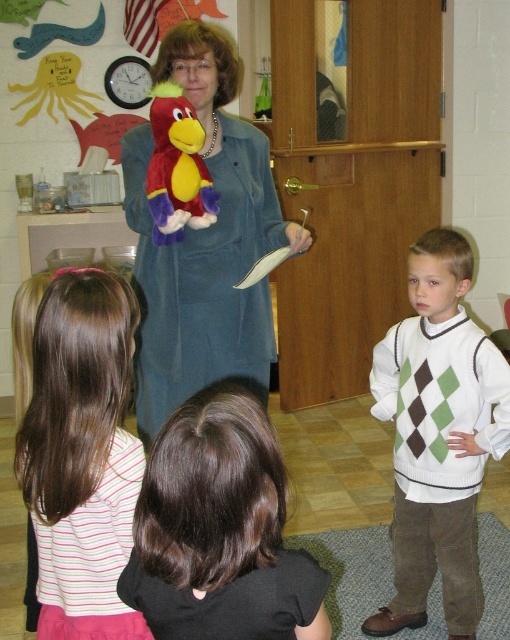
Which is more to the right, velvety blue coat at center or green argyle sweater at right?

green argyle sweater at right is more to the right.

Between point (201, 109) and point (436, 467), which one is positioned in front?

Point (201, 109) is more forward.

This screenshot has height=640, width=510. What do you see at coordinates (204, 243) in the screenshot?
I see `velvety blue coat at center` at bounding box center [204, 243].

The height and width of the screenshot is (640, 510). I want to click on velvety blue coat at center, so click(204, 243).

This screenshot has height=640, width=510. What do you see at coordinates (204, 243) in the screenshot?
I see `velvety blue coat at center` at bounding box center [204, 243].

Is point (182, 372) farther from viewer compared to point (197, 204)?

That is True.

Locate an element on the screen. The image size is (510, 640). velvety blue coat at center is located at coordinates [x=204, y=243].

Is green argyle sweater at right positioned at the back of velvet plush parrot at center?

Yes, it is behind velvet plush parrot at center.

How much distance is there between green argyle sweater at right and velvet plush parrot at center?

32.53 inches

In the scene shown: Who is more distant from viewer, (472, 512) or (160, 241)?

The point (472, 512) is behind.

This screenshot has width=510, height=640. I want to click on green argyle sweater at right, so click(x=438, y=436).